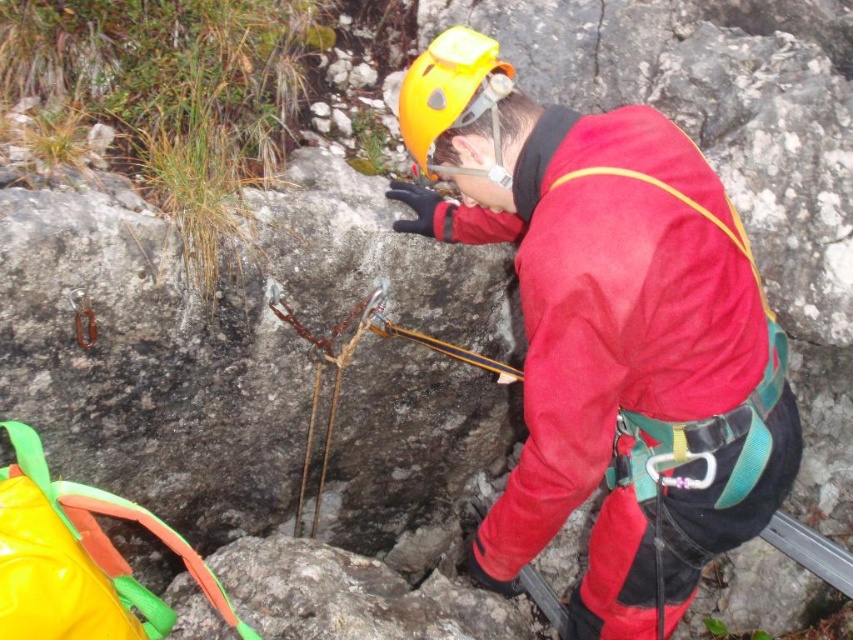
You are a rock climber preparing to ascend a route. You have a yellow fabric bag at lower left and a yellow matte helmet at center. Which object can you use to carry extra gear?

The yellow fabric bag at lower left can be used to carry extra gear because it is wider than the yellow matte helmet at center.

You are a hiker who needs to locate your gear. You see a matte red jacket at center and a yellow fabric bag at lower left. Which item is closer to your right side?

The matte red jacket at center is positioned on the right side of the yellow fabric bag at lower left, so it is closer to your right side.

You are a photographer trying to capture the climber from your current position. You notice two points marked on the rock face at coordinates point (190, 554) and point (496, 115). Which point will appear larger in your photo?

Point (190, 554) is closer to the camera than point (496, 115), so it will appear larger in the photo.